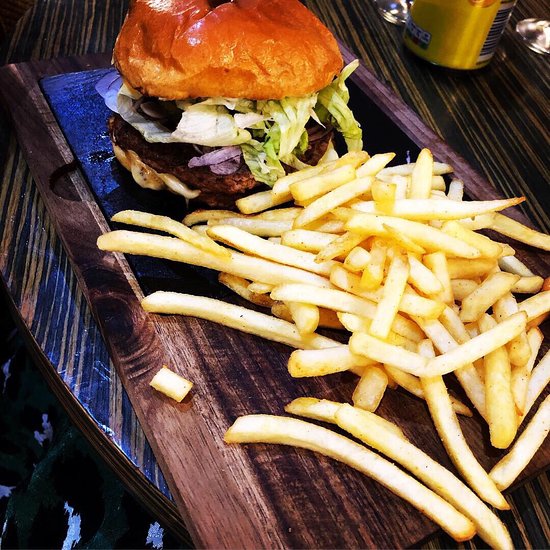
The width and height of the screenshot is (550, 550). Find the location of `blue and white table`. blue and white table is located at coordinates (x=103, y=394).